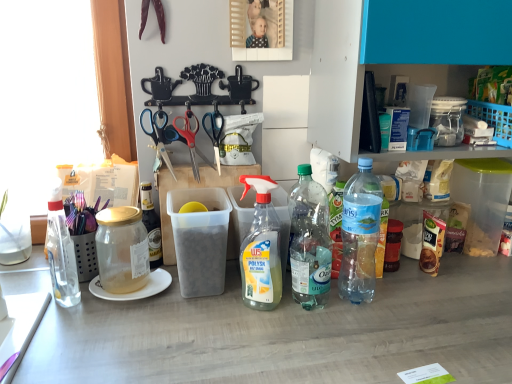
Question: Considering the relative positions of clear plastic bottle at center-right, the 1th bottle viewed from the right, and clear glass bottle at left, marked as the first bottle in a left-to-right arrangement, in the image provided, is clear plastic bottle at center-right, the 1th bottle viewed from the right, to the left or to the right of clear glass bottle at left, marked as the first bottle in a left-to-right arrangement,?

Choices:
 (A) right
 (B) left

Answer: (A)

Question: Is clear plastic bottle at center-right, the 1th bottle viewed from the right, in front of or behind clear glass bottle at left, marked as the first bottle in a left-to-right arrangement, in the image?

Choices:
 (A) front
 (B) behind

Answer: (B)

Question: Which is farther from the clear plastic bottle at center, the 3th bottle in the left-to-right sequence?

Choices:
 (A) clear plastic bottle at center-right, placed as the 2th bottle when sorted from right to left
 (B) black plastic scissors at center, placed as the 3th scissors when sorted from left to right
 (C) blue plastic scissors at upper center, the 3th scissors positioned from the right
 (D) red plastic scissors at center, which is the 2th scissors from right to left
 (E) transparent glass jar at left, which ranks as the fourth bottle in right-to-left order

Answer: (C)

Question: Estimate the real-world distances between objects in this image. Which object is closer to the transparent glass jar at left, which ranks as the fourth bottle in right-to-left order?

Choices:
 (A) white ceramic plate at left
 (B) black plastic scissors at center, placed as the 3th scissors when sorted from left to right
 (C) red plastic scissors at center, which is the second scissors from left to right
 (D) clear plastic bottle at center-right, marked as the 5th bottle in a left-to-right arrangement
 (E) clear plastic bottle at center-right, which is counted as the 4th bottle, starting from the left

Answer: (A)